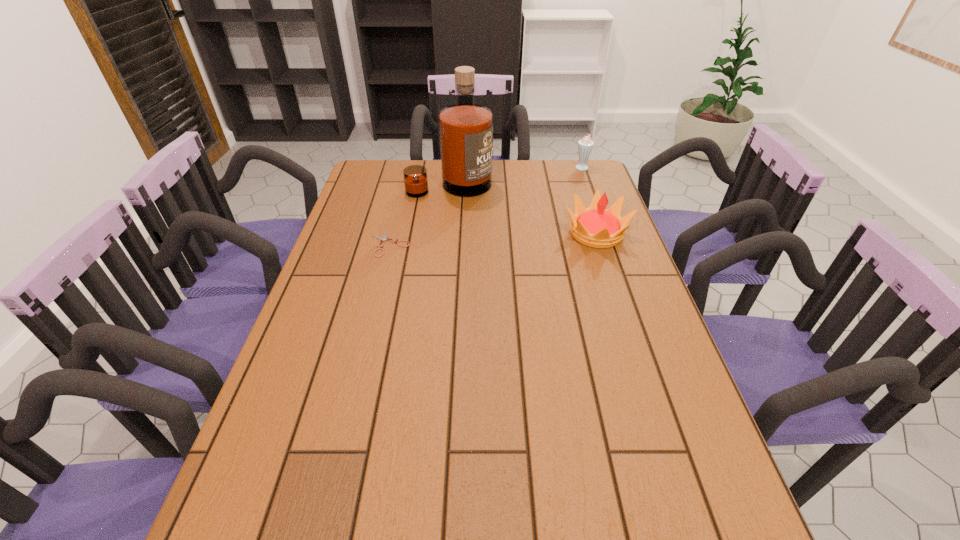
Where is `vacant space located 0.090m on the straw side of the farthest object`? The image size is (960, 540). vacant space located 0.090m on the straw side of the farthest object is located at coordinates (570, 180).

Locate an element on the screen. The height and width of the screenshot is (540, 960). vacant space situated on the straw side of the farthest object is located at coordinates (534, 216).

The image size is (960, 540). I want to click on vacant space located on the straw side of the farthest object, so click(x=565, y=185).

Locate an element on the screen. liquor that is at the far edge is located at coordinates (465, 129).

Find the location of `milkshake that is at the far edge`. milkshake that is at the far edge is located at coordinates (585, 145).

Where is `object at the left edge`? This screenshot has width=960, height=540. object at the left edge is located at coordinates (384, 238).

The height and width of the screenshot is (540, 960). I want to click on crown located in the right edge section of the desktop, so click(596, 227).

Locate an element on the screen. The image size is (960, 540). milkshake that is at the right edge is located at coordinates (585, 145).

Locate an element on the screen. This screenshot has width=960, height=540. object present at the far right corner is located at coordinates (585, 145).

The height and width of the screenshot is (540, 960). Find the location of `vacant space at the near edge of the desktop`. vacant space at the near edge of the desktop is located at coordinates (465, 493).